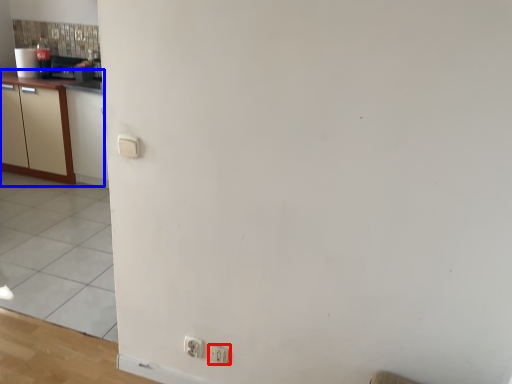
Question: Which point is further to the camera, electric outlet (highlighted by a red box) or cabinetry (highlighted by a blue box)?

Choices:
 (A) electric outlet
 (B) cabinetry

Answer: (B)